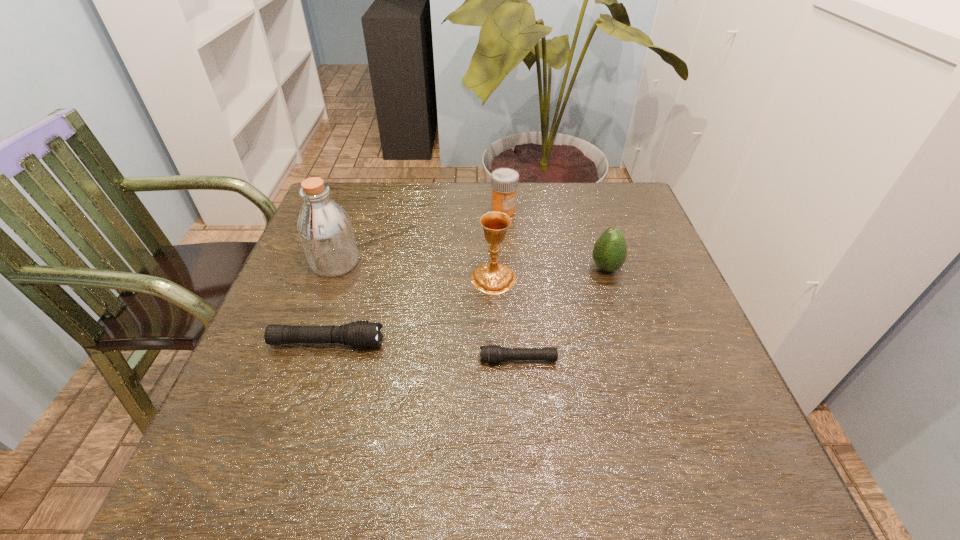
Find the location of `free space that satisfies the following two spatial constraints: 1. on the label side of the medicine; 2. on the right side of the avocado`. free space that satisfies the following two spatial constraints: 1. on the label side of the medicine; 2. on the right side of the avocado is located at coordinates (508, 268).